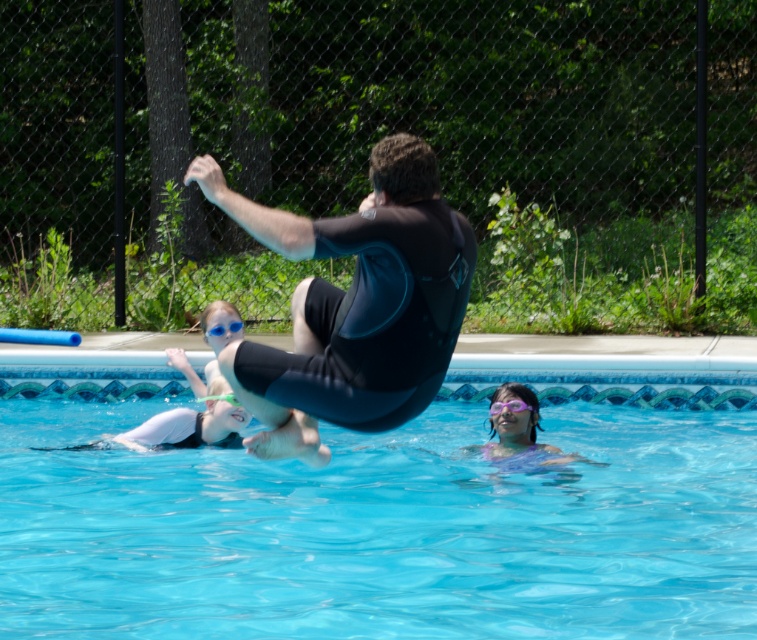
Looking at this image, you are a lifeguard assessing the pool area. You notice the black matte wetsuit at center and the purple matte goggles at lower center. Which object is wider?

The black matte wetsuit at center is wider than the purple matte goggles at lower center.

You are a lifeguard on duty and need to locate the black matte wetsuit at center and the purple matte goggles at lower center. According to the scene, which object is positioned to the left of the other?

The black matte wetsuit at center is positioned to the left of purple matte goggles at lower center.

You are a swimmer preparing to dive into the pool. You see the transparent blue water at center and the blue plastic goggles at center. Which object is located to the right of the other?

The transparent blue water at center is positioned on the right side of blue plastic goggles at center.